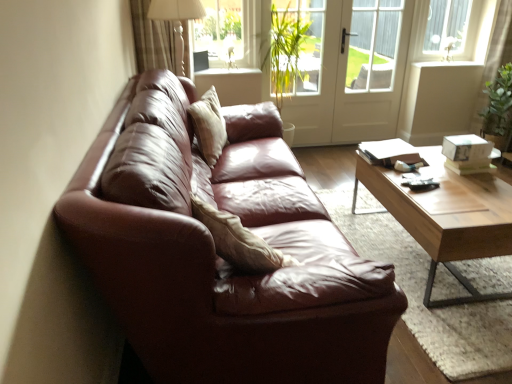
Question: Is white glossy door at center bigger or smaller than light brown wooden coffee table at center?

Choices:
 (A) big
 (B) small

Answer: (B)

Question: In terms of height, does white glossy door at center look taller or shorter compared to light brown wooden coffee table at center?

Choices:
 (A) short
 (B) tall

Answer: (B)

Question: Which object is the farthest from the transparent glass window at upper center?

Choices:
 (A) beige fabric pillow at center
 (B) white plastic window frame at upper right
 (C) green leafy plant at center
 (D) white glossy door at center
 (E) light brown wooden coffee table at center

Answer: (E)

Question: Estimate the real-world distances between objects in this image. Which object is farther from the matte white table lamp at upper center?

Choices:
 (A) light brown wooden coffee table at center
 (B) beige fabric pillow at center
 (C) white glossy door at center
 (D) white plastic window frame at upper right
 (E) transparent glass window at upper center

Answer: (D)